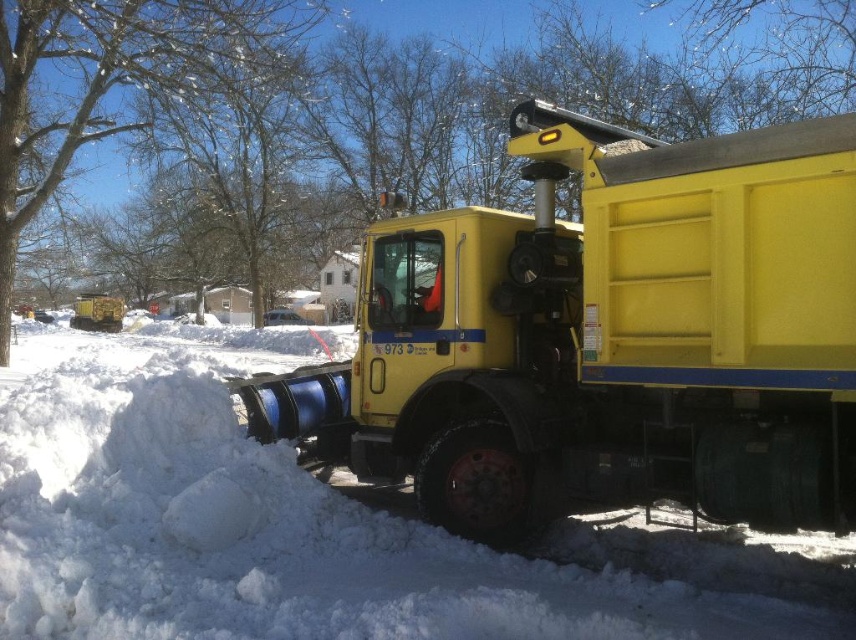
Is yellow matte truck at center smaller than white fluffy snow at lower left?

Yes.

Which is above, yellow matte truck at center or white fluffy snow at lower left?

yellow matte truck at center is above.

Between point (565, 282) and point (198, 531), which one is positioned behind?

Positioned behind is point (565, 282).

Locate an element on the screen. The height and width of the screenshot is (640, 856). yellow matte truck at center is located at coordinates (605, 339).